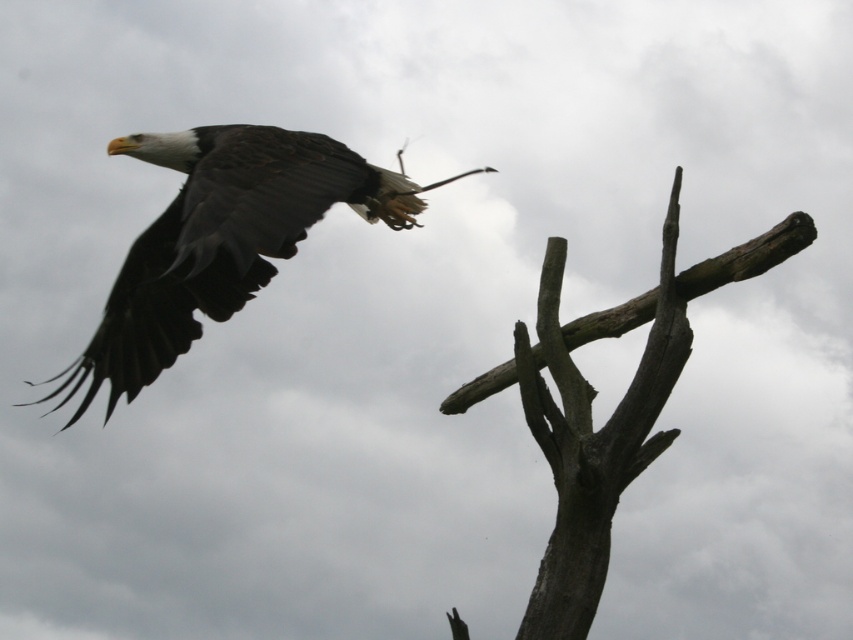
Between dark brown feathers at upper left and gray rough wood at upper right, which one has less height?

gray rough wood at upper right

Can you confirm if dark brown feathers at upper left is taller than gray rough wood at upper right?

Correct, dark brown feathers at upper left is much taller as gray rough wood at upper right.

Between point (218, 266) and point (555, 628), which one is positioned in front?

Point (555, 628)

Image resolution: width=853 pixels, height=640 pixels. In order to click on dark brown feathers at upper left in this screenshot , I will do `click(222, 240)`.